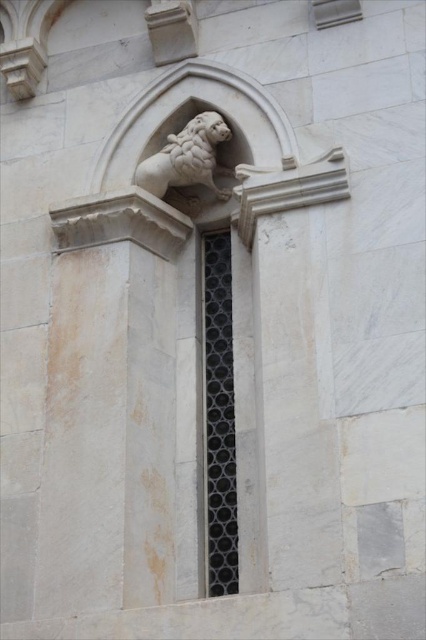
Question: Which of the following is the farthest from the observer?

Choices:
 (A) pos(212,458)
 (B) pos(189,170)

Answer: (B)

Question: Can you confirm if black mesh window at center is wider than white marble lion at upper center?

Choices:
 (A) no
 (B) yes

Answer: (A)

Question: Can you confirm if black mesh window at center is bigger than white marble lion at upper center?

Choices:
 (A) no
 (B) yes

Answer: (B)

Question: Can you confirm if black mesh window at center is positioned above white marble lion at upper center?

Choices:
 (A) yes
 (B) no

Answer: (B)

Question: Which of the following is the farthest from the observer?

Choices:
 (A) (215, 550)
 (B) (135, 172)

Answer: (B)